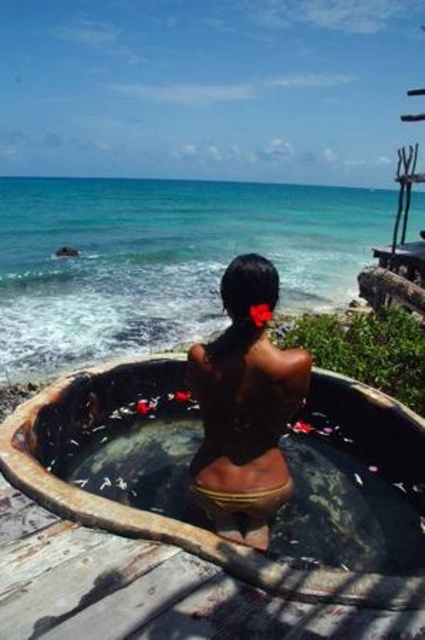
Question: Which is nearer to the smooth concrete tub at center?

Choices:
 (A) black matte swimsuit at center
 (B) rustic stone tub at center

Answer: (B)

Question: Based on their relative distances, which object is nearer to the rustic stone tub at center?

Choices:
 (A) black matte swimsuit at center
 (B) smooth concrete tub at center

Answer: (A)

Question: Is rustic stone tub at center positioned at the back of black matte swimsuit at center?

Choices:
 (A) no
 (B) yes

Answer: (A)

Question: Considering the relative positions of rustic stone tub at center and black matte swimsuit at center in the image provided, where is rustic stone tub at center located with respect to black matte swimsuit at center?

Choices:
 (A) left
 (B) right

Answer: (A)

Question: Is rustic stone tub at center wider than smooth concrete tub at center?

Choices:
 (A) no
 (B) yes

Answer: (A)

Question: Which point is farther to the camera?

Choices:
 (A) black matte swimsuit at center
 (B) smooth concrete tub at center
 (C) rustic stone tub at center

Answer: (B)